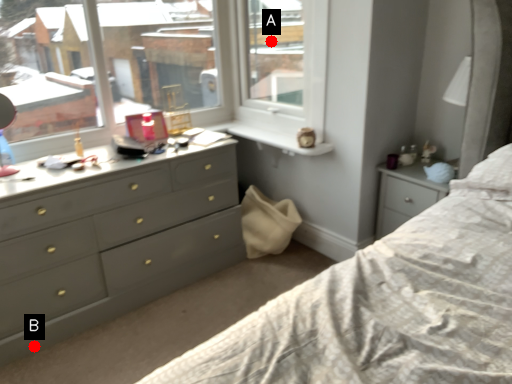
Question: Two points are circled on the image, labeled by A and B beside each circle. Which point is closer to the camera taking this photo?

Choices:
 (A) A is closer
 (B) B is closer

Answer: (B)